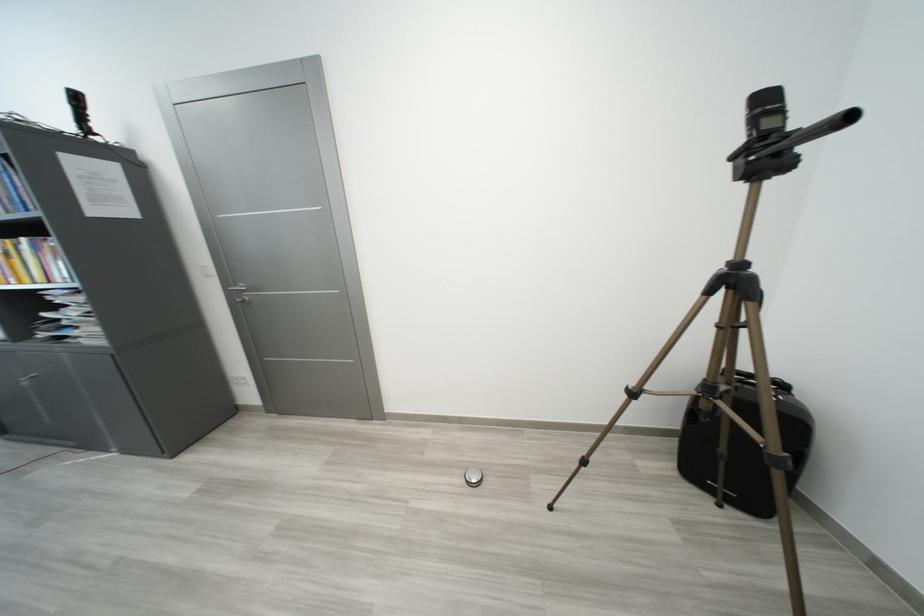
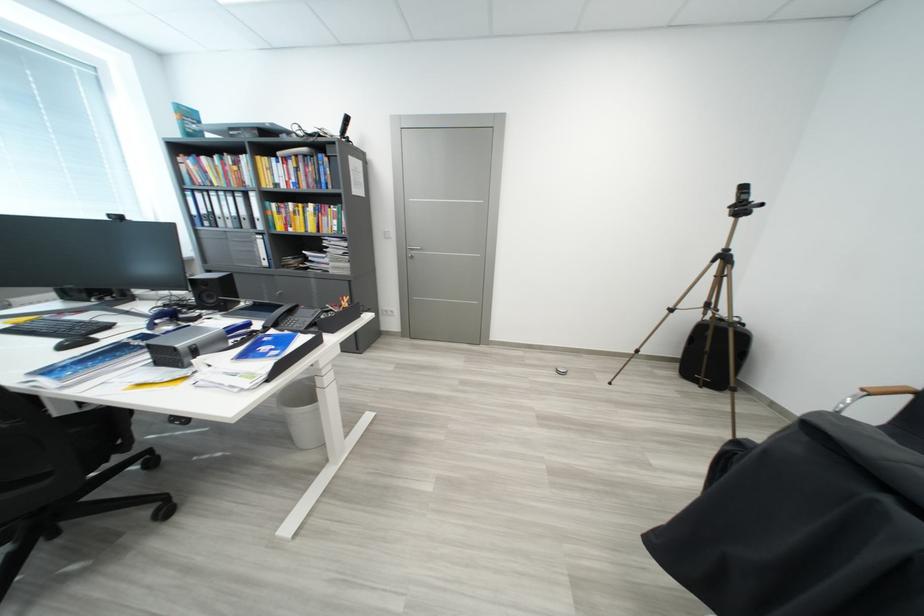
What movement of the cameraman would produce the second image?

The movement direction of the cameraman is left, backward.